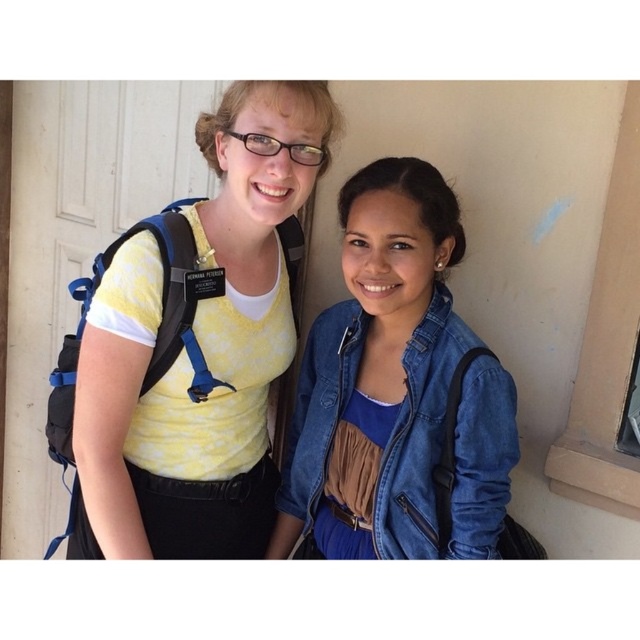
Can you confirm if yellow tie-dye t-shirt at left is taller than denim jacket at lower right?

Correct, yellow tie-dye t-shirt at left is much taller as denim jacket at lower right.

Is point (211, 456) more distant than point (368, 500)?

That is True.

This screenshot has width=640, height=640. Find the location of `yellow tie-dye t-shirt at left`. yellow tie-dye t-shirt at left is located at coordinates (202, 346).